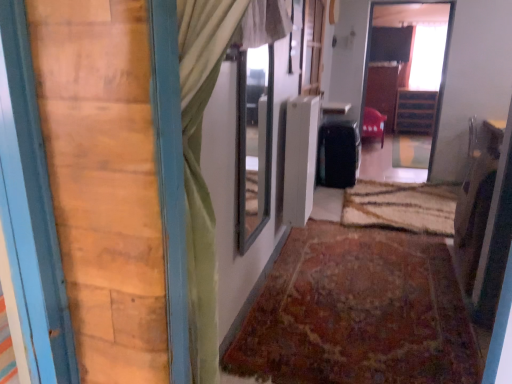
Where is `wooden barn door at left`? wooden barn door at left is located at coordinates (104, 182).

Locate an element on the screen. Image resolution: width=512 pixels, height=384 pixels. wooden dresser at upper right is located at coordinates (407, 65).

Identify the location of matte red chair at center, acting as the 2th furniture starting from the right. The image size is (512, 384). (373, 124).

The width and height of the screenshot is (512, 384). Find the location of `black matte suitcase at center`. black matte suitcase at center is located at coordinates (338, 154).

You are a GUI agent. You are given a task and a screenshot of the screen. Output one action in this format:
    pyautogui.click(x=<x>, y=<y>)
    Task: Click on the transparent glass window at upper right, which is the first window in top-to-bottom order
    The image size is (512, 384).
    Given the screenshot: What is the action you would take?
    pyautogui.click(x=426, y=56)

Does wooden cabinet at center, marked as the 1th furniture in a right-to-left arrangement, have a lesser width compared to matte red chair at center, arranged as the first furniture when viewed from the front?

Yes.

Based on the photo, from a real-world perspective, which is physically below, wooden cabinet at center, which is the second furniture from left to right, or matte red chair at center, acting as the 2th furniture starting from the right?

In real-world perspective, matte red chair at center, acting as the 2th furniture starting from the right, is lower.

Is wooden cabinet at center, which is the second furniture from left to right, located outside matte red chair at center, marked as the second furniture in a back-to-front arrangement?

Absolutely, wooden cabinet at center, which is the second furniture from left to right, is external to matte red chair at center, marked as the second furniture in a back-to-front arrangement.

From the image's perspective, which one is positioned higher, wooden cabinet at center, acting as the second furniture starting from the front, or matte red chair at center, which appears as the 1th furniture when viewed from the left?

wooden cabinet at center, acting as the second furniture starting from the front, from the image's perspective.

Is point (258, 126) closer to camera compared to point (438, 257)?

Yes, it is.

From the picture: Does clear glass window at center, the 1th window when ordered from left to right, have a greater width compared to rug at center, marked as the 1th doormat in a front-to-back arrangement?

In fact, clear glass window at center, the 1th window when ordered from left to right, might be narrower than rug at center, marked as the 1th doormat in a front-to-back arrangement.

How many degrees apart are the facing directions of clear glass window at center, which is counted as the second window, starting from the top, and rug at center, acting as the second doormat starting from the back?

clear glass window at center, which is counted as the second window, starting from the top, and rug at center, acting as the second doormat starting from the back, are facing 87 degrees away from each other.

Which is less distant, (x=263, y=101) or (x=352, y=185)?

The point (x=263, y=101) is in front.

Is clear glass window at center, marked as the second window in a right-to-left arrangement, positioned far away from black matte suitcase at center?

That's right, there is a large distance between clear glass window at center, marked as the second window in a right-to-left arrangement, and black matte suitcase at center.

Do you think clear glass window at center, marked as the second window in a right-to-left arrangement, is within black matte suitcase at center, or outside of it?

The correct answer is: outside.

Considering the positions of objects clear glass window at center, placed as the first window when sorted from bottom to top, and black matte suitcase at center in the image provided, who is in front, clear glass window at center, placed as the first window when sorted from bottom to top, or black matte suitcase at center?

Positioned in front is clear glass window at center, placed as the first window when sorted from bottom to top.

Is textured brown doormat at center, the 2th doormat when ordered from front to back, outside of wooden barn door at left?

Absolutely, textured brown doormat at center, the 2th doormat when ordered from front to back, is external to wooden barn door at left.

How many degrees apart are the facing directions of textured brown doormat at center, the 2th doormat when ordered from front to back, and wooden barn door at left?

178 degrees.

Is the surface of textured brown doormat at center, the first doormat positioned from the back, in direct contact with wooden barn door at left?

No, textured brown doormat at center, the first doormat positioned from the back, is not next to wooden barn door at left.

Which object is closer to the camera taking this photo, wooden dresser at upper right or black matte suitcase at center?

wooden dresser at upper right is closer to the camera.

From a real-world perspective, which is physically above, wooden dresser at upper right or black matte suitcase at center?

wooden dresser at upper right.

Would you say wooden dresser at upper right is a long distance from black matte suitcase at center?

Yes, wooden dresser at upper right is far from black matte suitcase at center.

The image size is (512, 384). What are the coordinates of `passage that appears in front of the matte red chair at center, arranged as the first furniture when viewed from the front` in the screenshot? It's located at (407, 65).

Which of these two, matte red chair at center, marked as the second furniture in a back-to-front arrangement, or wooden dresser at upper right, is thinner?

Thinner between the two is wooden dresser at upper right.

Who is shorter, matte red chair at center, marked as the second furniture in a back-to-front arrangement, or wooden dresser at upper right?

With less height is matte red chair at center, marked as the second furniture in a back-to-front arrangement.

Who is more distant, matte red chair at center, which appears as the 1th furniture when viewed from the left, or black matte suitcase at center?

matte red chair at center, which appears as the 1th furniture when viewed from the left, is further away from the camera.

From the image's perspective, which furniture is the 1st one above the black matte suitcase at center? Please provide its 2D coordinates.

[(373, 124)]

Is matte red chair at center, which appears as the 1th furniture when viewed from the left, oriented towards black matte suitcase at center?

No, matte red chair at center, which appears as the 1th furniture when viewed from the left, is not facing towards black matte suitcase at center.

Can you tell me how much matte red chair at center, acting as the 2th furniture starting from the right, and black matte suitcase at center differ in facing direction?

matte red chair at center, acting as the 2th furniture starting from the right, and black matte suitcase at center are facing 0.000444 degrees away from each other.

In the image, there is a matte red chair at center, marked as the second furniture in a back-to-front arrangement. Identify the location of furniture above it (from the image's perspective). Image resolution: width=512 pixels, height=384 pixels. (415, 111).

Where is `doormat that is the 1st one when counting rightward from the clear glass window at center, marked as the second window in a right-to-left arrangement`? The width and height of the screenshot is (512, 384). doormat that is the 1st one when counting rightward from the clear glass window at center, marked as the second window in a right-to-left arrangement is located at coordinates (358, 312).

When comparing their distances from clear glass window at center, the 2th window when ordered from back to front, does matte red chair at center, arranged as the first furniture when viewed from the front, or rug at center, acting as the second doormat starting from the back, seem closer?

rug at center, acting as the second doormat starting from the back, lies closer to clear glass window at center, the 2th window when ordered from back to front, than the other object.

From the picture: Based on their spatial positions, is wooden cabinet at center, which is the second furniture from left to right, or rug at center, marked as the 1th doormat in a front-to-back arrangement, further from matte red chair at center, arranged as the first furniture when viewed from the front?

The object further to matte red chair at center, arranged as the first furniture when viewed from the front, is rug at center, marked as the 1th doormat in a front-to-back arrangement.

Which object lies nearer to the anchor point rug at center, marked as the 1th doormat in a front-to-back arrangement, wooden cabinet at center, marked as the 1th furniture in a right-to-left arrangement, or textured brown doormat at center, the 2th doormat when ordered from front to back?

textured brown doormat at center, the 2th doormat when ordered from front to back, lies closer to rug at center, marked as the 1th doormat in a front-to-back arrangement, than the other object.

Which object lies nearer to the anchor point clear glass window at center, the 1th window when ordered from left to right, wooden cabinet at center, which is the second furniture from left to right, or wooden dresser at upper right?

wooden dresser at upper right.

Looking at the image, which one is located closer to wooden cabinet at center, the 1th furniture in the back-to-front sequence, wooden dresser at upper right or black matte suitcase at center?

The object closer to wooden cabinet at center, the 1th furniture in the back-to-front sequence, is wooden dresser at upper right.

When comparing their distances from rug at center, acting as the second doormat starting from the back, does textured brown doormat at center, the first doormat positioned from the back, or wooden barn door at left seem closer?

Among the two, textured brown doormat at center, the first doormat positioned from the back, is located nearer to rug at center, acting as the second doormat starting from the back.

From the picture: Which object lies nearer to the anchor point wooden barn door at left, black matte suitcase at center or rug at center, marked as the 1th doormat in a front-to-back arrangement?

rug at center, marked as the 1th doormat in a front-to-back arrangement, is positioned closer to the anchor wooden barn door at left.

Which object lies nearer to the anchor point textured brown doormat at center, the first doormat positioned from the back, wooden barn door at left or wooden dresser at upper right?

The object closer to textured brown doormat at center, the first doormat positioned from the back, is wooden dresser at upper right.

Identify the location of furniture located between textured brown doormat at center, the 2th doormat when ordered from front to back, and transparent glass window at upper right, which is the first window in top-to-bottom order, in the depth direction. Image resolution: width=512 pixels, height=384 pixels. (373, 124).

Locate an element on the screen. Image resolution: width=512 pixels, height=384 pixels. passage between textured brown doormat at center, the 2th doormat when ordered from front to back, and matte red chair at center, marked as the second furniture in a back-to-front arrangement, along the z-axis is located at coordinates (407, 65).

Identify the location of doormat between clear glass window at center, which is counted as the second window, starting from the top, and transparent glass window at upper right, the second window from the front, in the front-back direction. The image size is (512, 384). (401, 206).

You are a GUI agent. You are given a task and a screenshot of the screen. Output one action in this format:
    pyautogui.click(x=<x>, y=<y>)
    Task: Click on the window between textured brown doormat at center, the 2th doormat when ordered from front to back, and wooden cabinet at center, acting as the second furniture starting from the front, from front to back
    The image size is (512, 384).
    Given the screenshot: What is the action you would take?
    pyautogui.click(x=426, y=56)